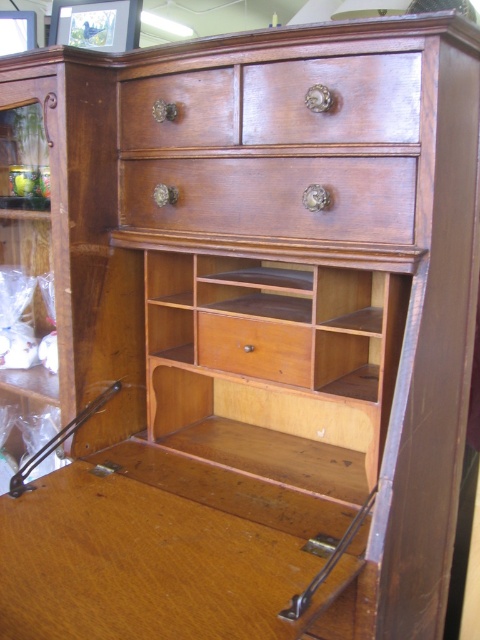
What object is located at the coordinate point (163, 552) in the image?

The wooden desk at center is located at the coordinate point (163, 552).

You are standing in front of the vintage wooden secretary desk and notice two points marked on its surface. The first point is at coordinate point (180, 547) and the second is at point (247, 365). Which of these two points is nearer to you?

Point (180, 547) is closer to the viewer than point (247, 365).

Based on the scene description, what are the coordinates of the wooden desk at center?

The wooden desk at center is located at coordinates (163, 552).